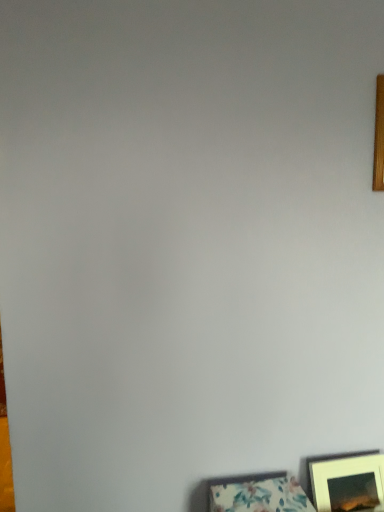
Question: Could floral fabric picture frame at lower right, the third picture frame when ordered from right to left, be considered to be inside wooden frame at upper right, the 3th picture frame positioned from the left?

Choices:
 (A) no
 (B) yes

Answer: (A)

Question: Can you confirm if wooden frame at upper right, positioned as the third picture frame in bottom-to-top order, is thinner than floral fabric picture frame at lower right, which is the first picture frame in left-to-right order?

Choices:
 (A) no
 (B) yes

Answer: (B)

Question: Can you confirm if wooden frame at upper right, the 3th picture frame positioned from the left, is taller than floral fabric picture frame at lower right, which is the first picture frame in left-to-right order?

Choices:
 (A) no
 (B) yes

Answer: (B)

Question: Is wooden frame at upper right, which is the first picture frame from right to left, facing towards floral fabric picture frame at lower right, placed as the 3th picture frame when sorted from top to bottom?

Choices:
 (A) yes
 (B) no

Answer: (B)

Question: From a real-world perspective, is wooden frame at upper right, positioned as the third picture frame in bottom-to-top order, below floral fabric picture frame at lower right, which is the first picture frame in left-to-right order?

Choices:
 (A) yes
 (B) no

Answer: (B)

Question: Is wooden frame at upper right, which appears as the 1th picture frame when viewed from the top, to the left or to the right of floral fabric picture frame at lower right, the third picture frame when ordered from right to left, in the image?

Choices:
 (A) left
 (B) right

Answer: (B)

Question: Considering the positions of wooden frame at upper right, the 3th picture frame positioned from the left, and floral fabric picture frame at lower right, placed as the 3th picture frame when sorted from top to bottom, in the image, is wooden frame at upper right, the 3th picture frame positioned from the left, wider or thinner than floral fabric picture frame at lower right, placed as the 3th picture frame when sorted from top to bottom,?

Choices:
 (A) thin
 (B) wide

Answer: (A)

Question: Based on their sizes in the image, would you say wooden frame at upper right, positioned as the third picture frame in bottom-to-top order, is bigger or smaller than floral fabric picture frame at lower right, which is the first picture frame in left-to-right order?

Choices:
 (A) small
 (B) big

Answer: (A)

Question: From a real-world perspective, is wooden frame at upper right, positioned as the third picture frame in bottom-to-top order, physically located above or below floral fabric picture frame at lower right, the third picture frame when ordered from right to left?

Choices:
 (A) below
 (B) above

Answer: (B)

Question: From the image's perspective, relative to wooden frame at upper right, positioned as the third picture frame in bottom-to-top order, is floral fabric picture frame at lower right, which is the first picture frame in left-to-right order, above or below?

Choices:
 (A) above
 (B) below

Answer: (B)

Question: Is floral fabric picture frame at lower right, the third picture frame when ordered from right to left, situated inside wooden frame at upper right, positioned as the third picture frame in bottom-to-top order, or outside?

Choices:
 (A) inside
 (B) outside

Answer: (B)

Question: From a real-world perspective, is floral fabric picture frame at lower right, placed as the 3th picture frame when sorted from top to bottom, physically located above or below wooden frame at upper right, positioned as the third picture frame in bottom-to-top order?

Choices:
 (A) above
 (B) below

Answer: (B)

Question: Based on their positions, is floral fabric picture frame at lower right, positioned as the 1th picture frame in bottom-to-top order, located to the left or right of wooden frame at upper right, the 3th picture frame positioned from the left?

Choices:
 (A) left
 (B) right

Answer: (A)

Question: From the image's perspective, is matte white picture frame at lower right, which ranks as the 2th picture frame in left-to-right order, above or below floral fabric picture frame at lower right, the third picture frame when ordered from right to left?

Choices:
 (A) below
 (B) above

Answer: (B)

Question: Is point (370, 494) positioned closer to the camera than point (235, 498)?

Choices:
 (A) farther
 (B) closer

Answer: (A)